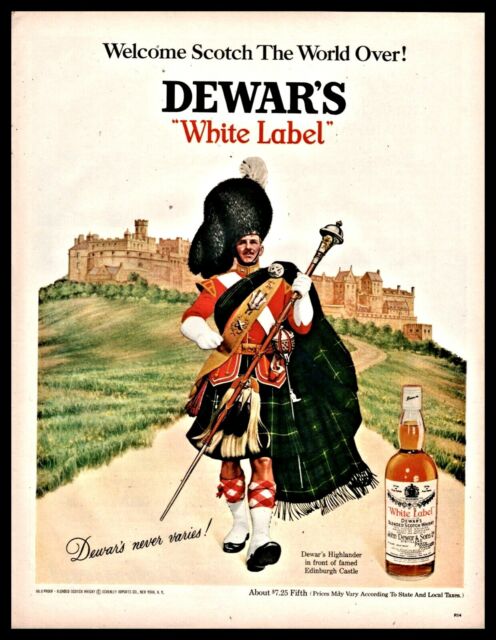
Image resolution: width=496 pixels, height=640 pixels. Identify the location of cork. (412, 388).